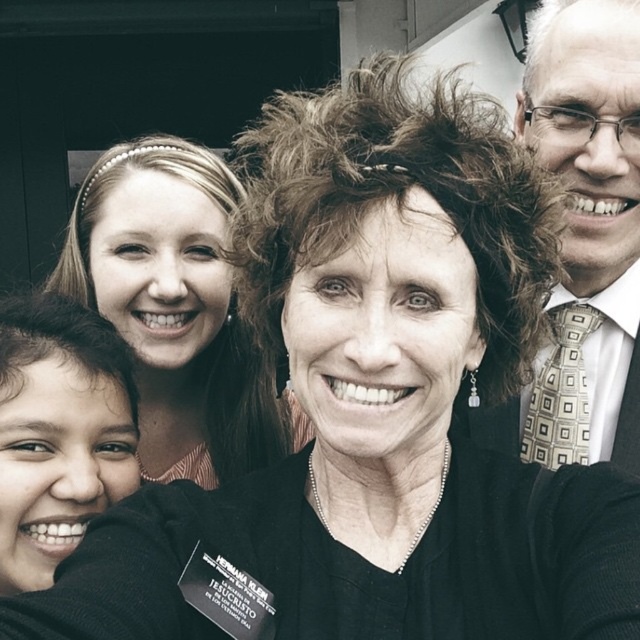
Question: Does smooth skin face at lower left have a smaller size compared to gold-patterned tie at right?

Choices:
 (A) no
 (B) yes

Answer: (A)

Question: Which object is farther from the camera taking this photo?

Choices:
 (A) smooth skin face at lower left
 (B) matte black hair at center

Answer: (B)

Question: Is smooth skin face at lower left to the right of gold-patterned tie at right from the viewer's perspective?

Choices:
 (A) yes
 (B) no

Answer: (B)

Question: Can you confirm if matte black hair at center is positioned to the right of gold-patterned tie at right?

Choices:
 (A) no
 (B) yes

Answer: (A)

Question: Estimate the real-world distances between objects in this image. Which object is closer to the smooth skin face at lower left?

Choices:
 (A) matte black hair at center
 (B) gold-patterned tie at right

Answer: (A)

Question: Considering the real-world distances, which object is closest to the matte black hair at center?

Choices:
 (A) gold-patterned tie at right
 (B) smooth skin face at lower left

Answer: (B)